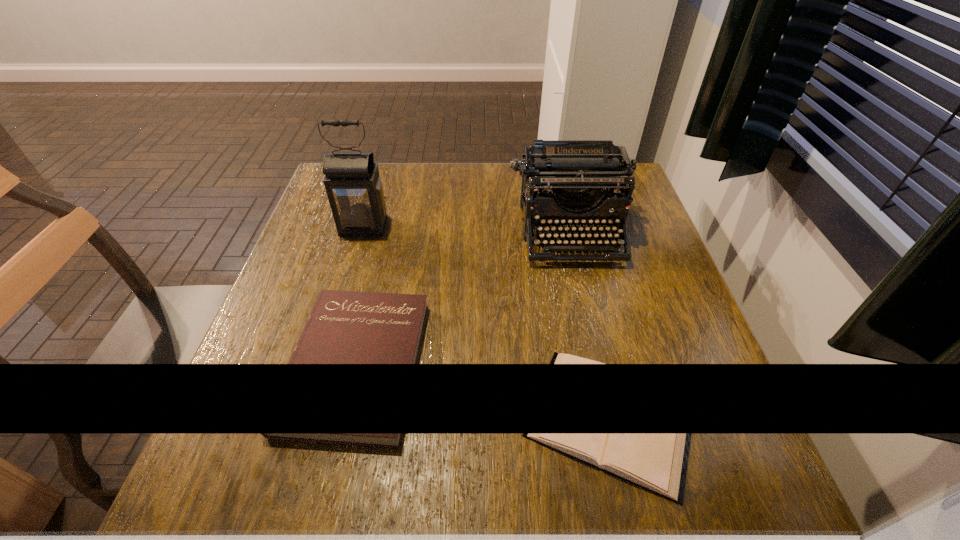
The image size is (960, 540). In order to click on object that is at the far edge in this screenshot , I will do `click(569, 175)`.

You are a GUI agent. You are given a task and a screenshot of the screen. Output one action in this format:
    pyautogui.click(x=<x>, y=<y>)
    Task: Click on the object that is at the near edge
    This screenshot has height=540, width=960.
    Given the screenshot: What is the action you would take?
    pyautogui.click(x=558, y=358)

This screenshot has height=540, width=960. In order to click on lantern that is at the left edge in this screenshot , I will do `click(352, 181)`.

Locate an element on the screen. This screenshot has width=960, height=540. hardback book located in the left edge section of the desktop is located at coordinates (344, 327).

Identify the location of typewriter located at the right edge. (569, 175).

Identify the location of hardback book located at the right edge. This screenshot has width=960, height=540. (558, 358).

Identify the location of object that is positioned at the far right corner. (569, 175).

The image size is (960, 540). Find the location of `object present at the near right corner`. object present at the near right corner is located at coordinates (558, 358).

This screenshot has width=960, height=540. I want to click on vacant space at the far edge, so click(x=504, y=186).

Locate an element on the screen. free space at the left edge is located at coordinates (264, 347).